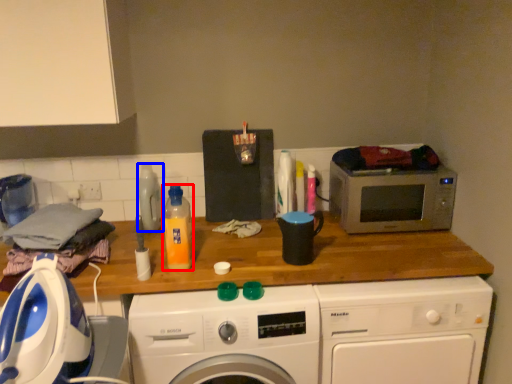
Question: Which point is closer to the camera, bottle (highlighted by a red box) or bottle (highlighted by a blue box)?

Choices:
 (A) bottle
 (B) bottle

Answer: (A)